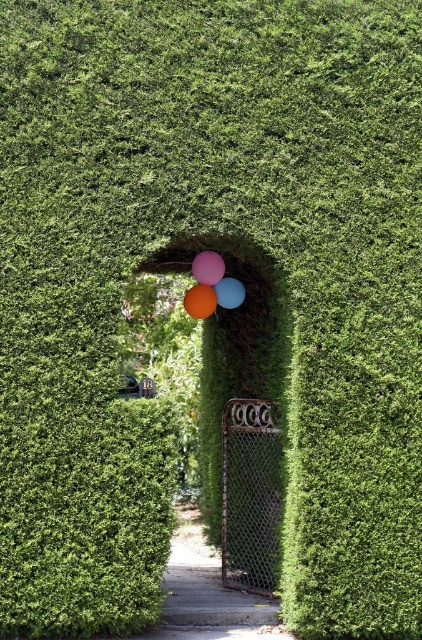
Question: Is rusty chain-link fence at center further to camera compared to orange matte balloon at center?

Choices:
 (A) no
 (B) yes

Answer: (B)

Question: Is orange matte balloon at center to the left of blue glossy balloon at center from the viewer's perspective?

Choices:
 (A) yes
 (B) no

Answer: (A)

Question: Is rusty chain-link fence at center behind blue glossy balloon at center?

Choices:
 (A) no
 (B) yes

Answer: (B)

Question: Which point is closer to the camera?

Choices:
 (A) (227, 584)
 (B) (208, 289)

Answer: (B)

Question: Among these objects, which one is nearest to the camera?

Choices:
 (A) matte orange balloon at center
 (B) orange matte balloon at center
 (C) rusty chain-link fence at center

Answer: (B)

Question: Which object is positioned farthest from the orange matte balloon at center?

Choices:
 (A) matte orange balloon at center
 (B) rusty chain-link fence at center

Answer: (B)